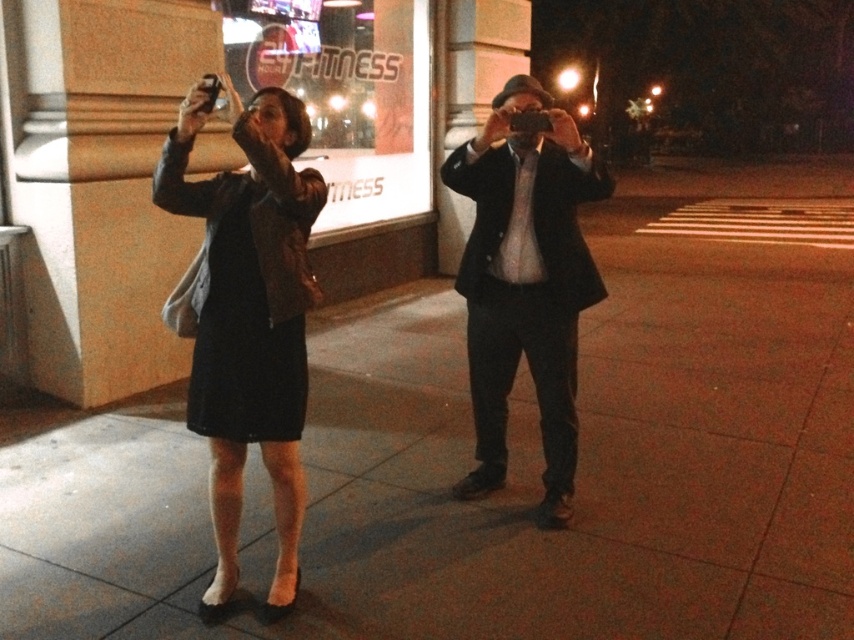
From the picture: Which is above, leather jacket at left or dark suit at center?

dark suit at center is higher up.

Does leather jacket at left appear over dark suit at center?

No.

This screenshot has height=640, width=854. Find the location of `leather jacket at left`. leather jacket at left is located at coordinates (247, 316).